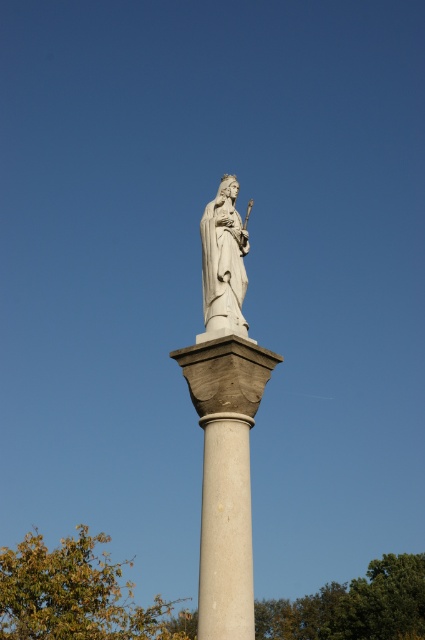
You are an architect planning to place a new sculpture in the square. You have two options, a large sculpture and a small sculpture. The white marble column at center and the white marble statue at center are already present. Based on their sizes, which existing object should the large sculpture be placed next to to maintain visual balance?

The white marble statue at center is larger than the white marble column at center. To maintain visual balance, the large sculpture should be placed next to the smaller white marble column at center.

You are standing in front of the monument and want to know which of the two points, point (238, 628) or point (212, 253), is closer to you. Can you determine this based on their positions?

Point (238, 628) is closer to the viewer than point (212, 253).